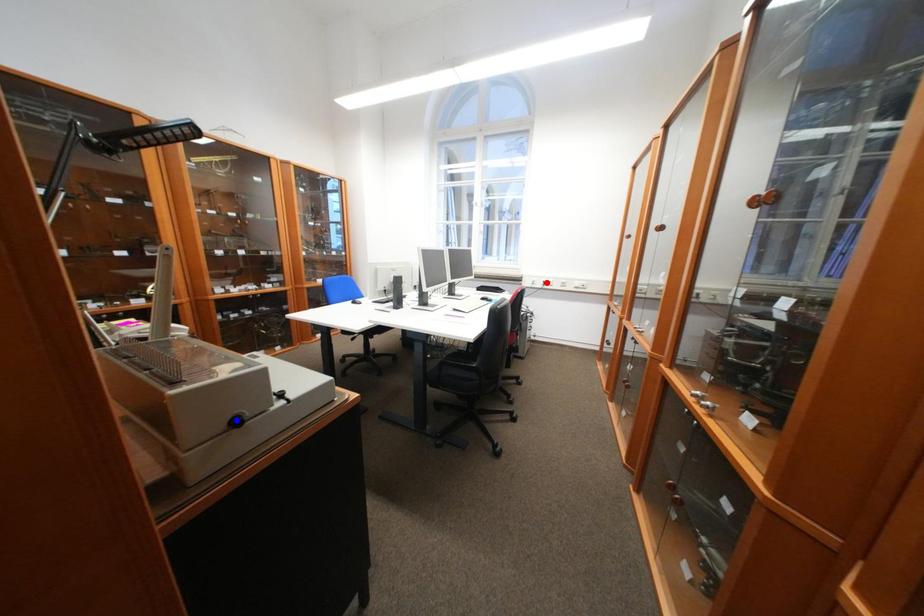
Question: Which of the two points in the image is closer to the camera?

Choices:
 (A) Blue point is closer.
 (B) Red point is closer.

Answer: (A)